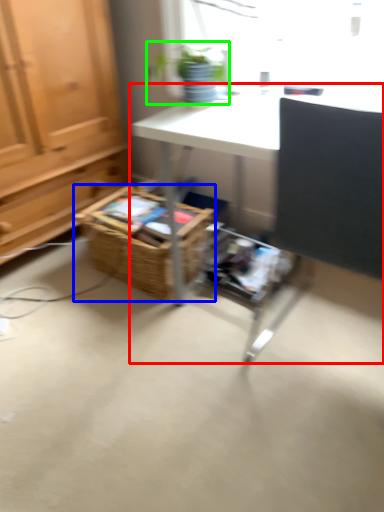
Question: Which object is the closest to the desk (highlighted by a red box)? Choose among these: basket (highlighted by a blue box) or houseplant (highlighted by a green box).

Choices:
 (A) basket
 (B) houseplant

Answer: (B)